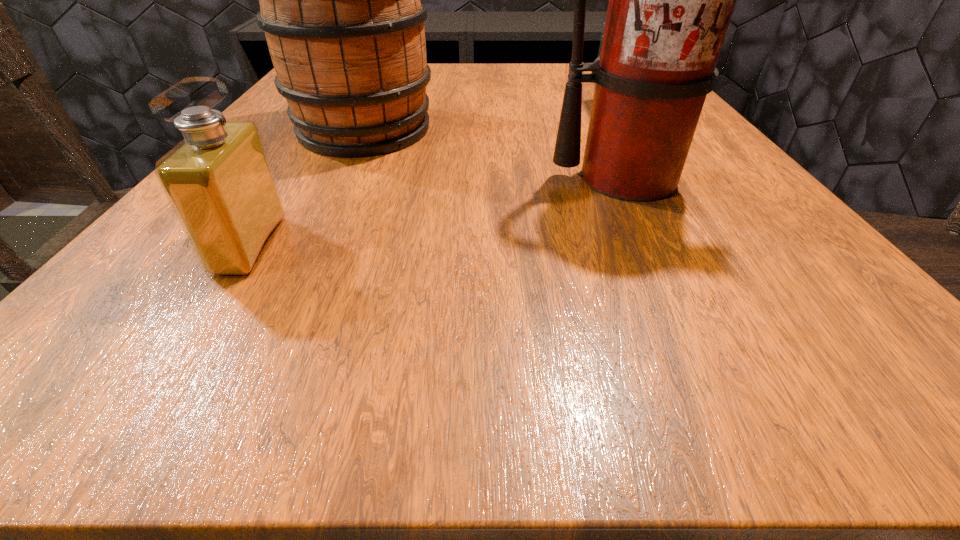
The height and width of the screenshot is (540, 960). In order to click on free space located on the front-facing side of the nearest object in this screenshot , I will do `click(564, 245)`.

Identify the location of cider present at the left edge. This screenshot has height=540, width=960. (340, 5).

Locate an element on the screen. perfume situated at the left edge is located at coordinates (218, 180).

Identify the location of fire extinguisher present at the right edge. (671, 0).

You are a GUI agent. You are given a task and a screenshot of the screen. Output one action in this format:
    pyautogui.click(x=<x>, y=<y>)
    Task: Click on the perfume present at the right edge
    
    Given the screenshot: What is the action you would take?
    pyautogui.click(x=602, y=32)

You are a GUI agent. You are given a task and a screenshot of the screen. Output one action in this format:
    pyautogui.click(x=<x>, y=<y>)
    Task: Click on the vacant area at the far edge of the desktop
    The width and height of the screenshot is (960, 540).
    Given the screenshot: What is the action you would take?
    coord(527,66)

Where is `vacant space at the left edge`? vacant space at the left edge is located at coordinates (203, 287).

Locate an element on the screen. The height and width of the screenshot is (540, 960). vacant area at the right edge of the desktop is located at coordinates (720, 259).

Locate an element on the screen. This screenshot has height=540, width=960. blank space at the near right corner of the desktop is located at coordinates (878, 326).

The height and width of the screenshot is (540, 960). Identify the location of vacant point located between the tallest object and the cider. (494, 154).